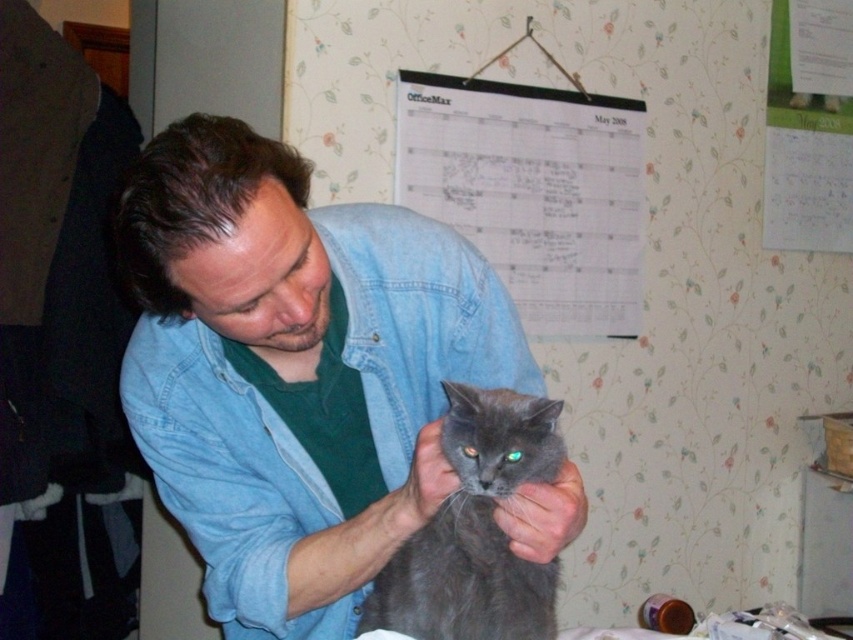
You are a photographer trying to capture a clear photo of the fuzzy gray cat at center and gray fluffy cat at center. Since both cats are in the same position, which one would appear wider in the photo?

The fuzzy gray cat at center would appear wider in the photo because its width surpasses that of the gray fluffy cat at center.

You are standing in the room and need to place a small plant pot exactly where the faded denim jacket at center is located. What are the coordinates you should use?

The coordinates for the faded denim jacket at center are at point [228,477], so you should place the plant pot at those coordinates.

You are a photographer trying to capture the man and the cat in the scene. Since there are two cats, the fuzzy gray cat at center and the gray fluffy cat at center, which one is positioned higher in the image?

The fuzzy gray cat at center is located above the gray fluffy cat at center, so it is positioned higher in the image.